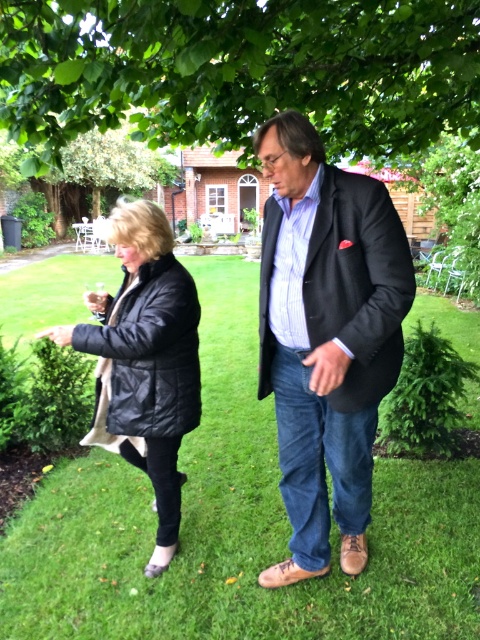
Question: Is the position of black leather jacket at center less distant than that of black quilted jacket at left?

Choices:
 (A) no
 (B) yes

Answer: (B)

Question: Which point is farther from the camera taking this photo?

Choices:
 (A) (269, 76)
 (B) (199, 381)
 (C) (328, 188)
 (D) (348, 214)

Answer: (A)

Question: Which object appears farthest from the camera in this image?

Choices:
 (A) matte black blazer at center
 (B) black leather jacket at center
 (C) black quilted jacket at left
 (D) green leafy tree at upper center

Answer: (D)

Question: Which point is farther to the camera?

Choices:
 (A) (324, 540)
 (B) (180, 58)
 (C) (172, 492)
 (D) (384, 312)

Answer: (C)

Question: Can you confirm if green leafy tree at upper center is wider than black leather jacket at center?

Choices:
 (A) yes
 (B) no

Answer: (A)

Question: Does black leather jacket at center have a greater width compared to black quilted jacket at left?

Choices:
 (A) no
 (B) yes

Answer: (A)